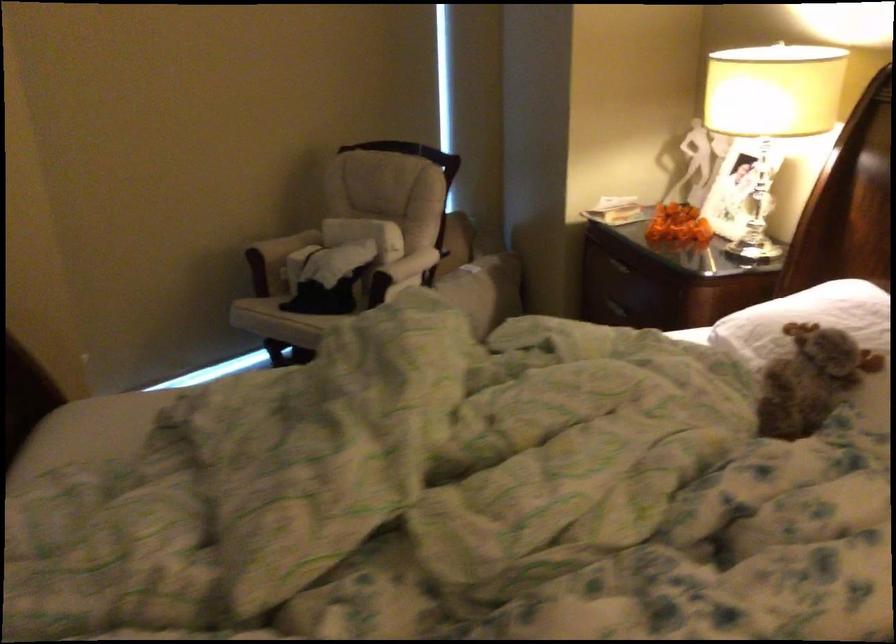
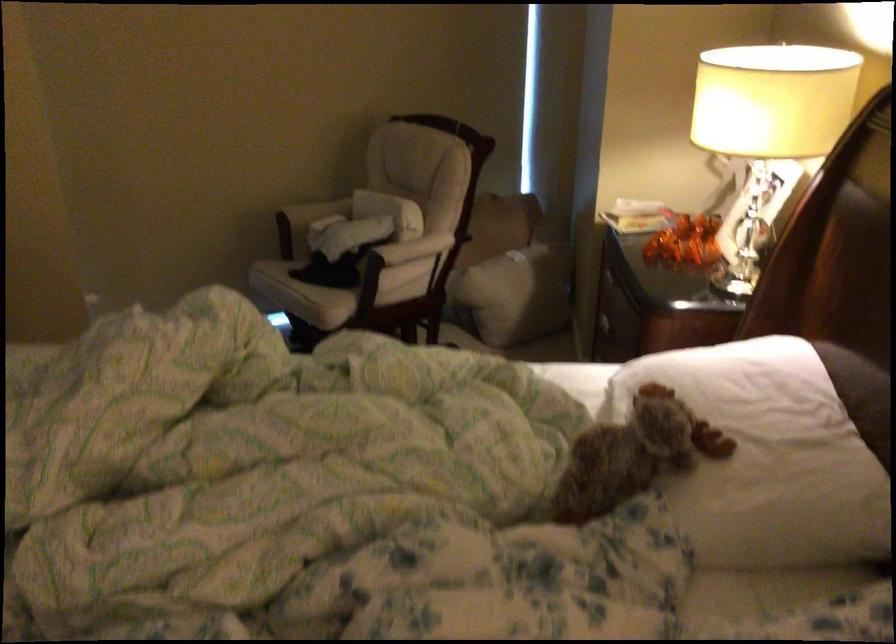
Where in the second image is the point corresponding to point (815, 375) from the first image?

(633, 453)